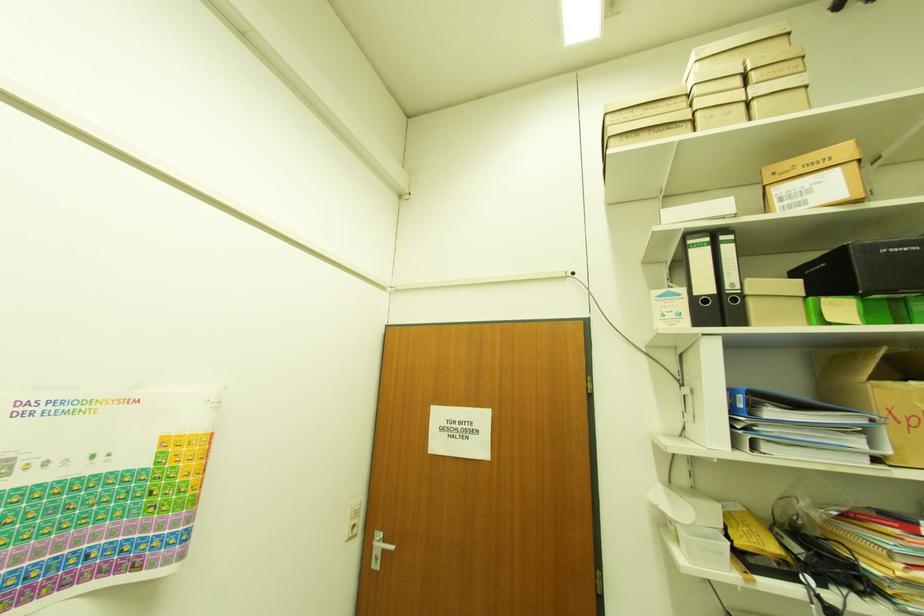
The width and height of the screenshot is (924, 616). What do you see at coordinates (383, 545) in the screenshot?
I see `a silver door handle` at bounding box center [383, 545].